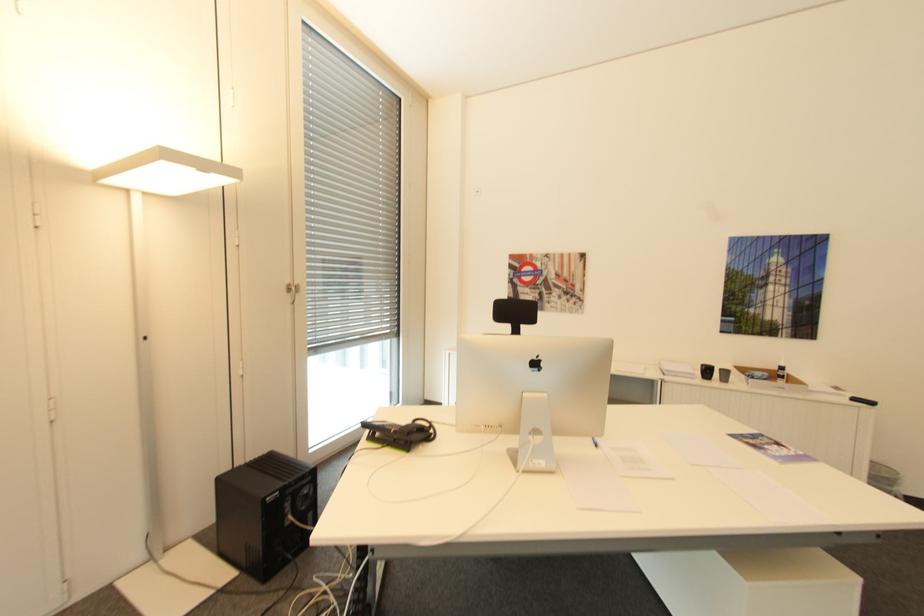
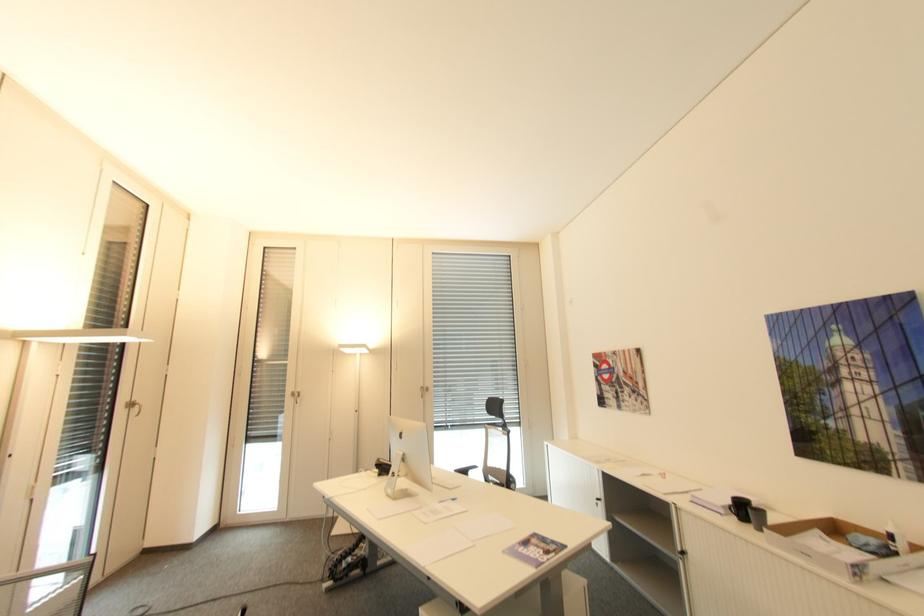
Find the pixel in the second image that matches (x=730, y=371) in the first image.

(766, 513)